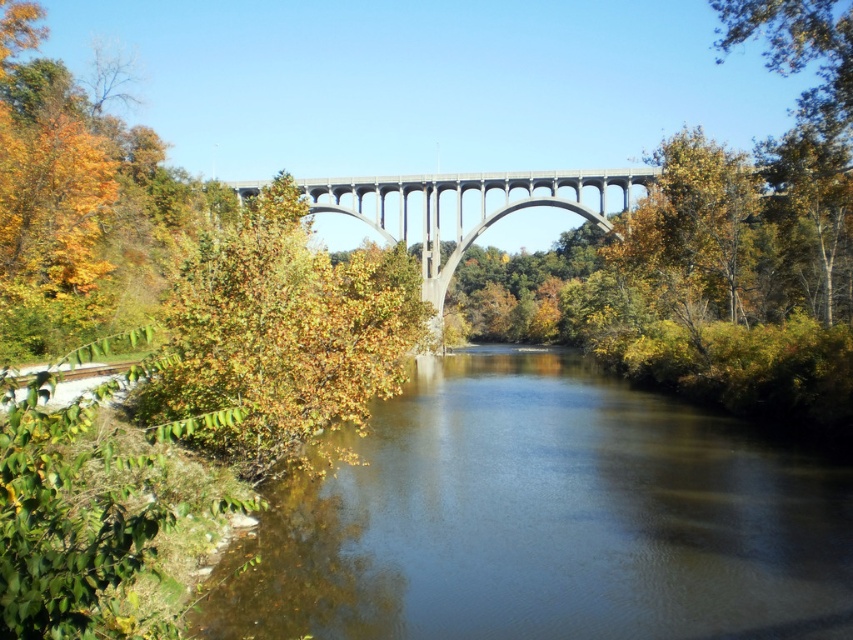
Who is shorter, green leafy tree at left or concrete bridge at center?

With less height is concrete bridge at center.

Is green leafy tree at left positioned at the back of concrete bridge at center?

No, it is not.

Locate an element on the screen. The image size is (853, 640). green leafy tree at left is located at coordinates (281, 333).

This screenshot has height=640, width=853. What are the coordinates of `dark blue water at center` in the screenshot? It's located at (544, 518).

From the picture: Can you confirm if dark blue water at center is smaller than concrete bridge at center?

Incorrect, dark blue water at center is not smaller in size than concrete bridge at center.

Where is `dark blue water at center`? This screenshot has height=640, width=853. dark blue water at center is located at coordinates (544, 518).

This screenshot has height=640, width=853. In order to click on dark blue water at center in this screenshot , I will do `click(544, 518)`.

Is dark blue water at center to the left of green leafy tree at left from the viewer's perspective?

No, dark blue water at center is not to the left of green leafy tree at left.

Which is in front, point (645, 461) or point (254, 420)?

Point (254, 420) is in front.

Is point (552, 625) behind point (346, 305)?

No, (552, 625) is in front of (346, 305).

You are a GUI agent. You are given a task and a screenshot of the screen. Output one action in this format:
    pyautogui.click(x=<x>, y=<y>)
    Task: Click on the dark blue water at center
    
    Given the screenshot: What is the action you would take?
    pyautogui.click(x=544, y=518)